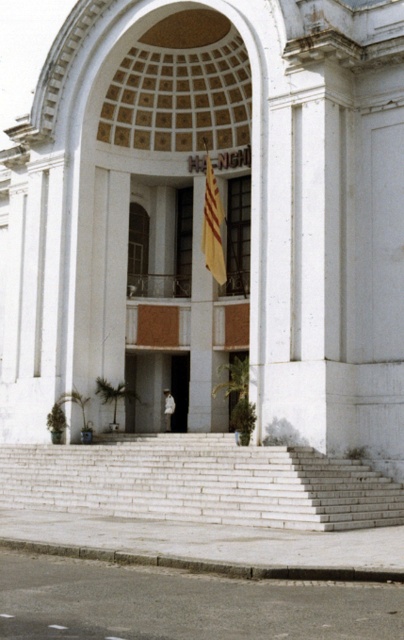
You are a visitor approaching the grand classical building. You see the white stone stairs at center and the white matte skateboarder at center. Which object is closer to the entrance?

The white matte skateboarder at center is closer to the entrance because it is positioned above the white stone stairs at center, which are located under it.

You are a delivery person with a cart that is 1.2 meters wide. You need to move from the white stone stairs at center to the white matte skateboarder at center. Is there enough space between them for your cart to pass through?

The white stone stairs at center and white matte skateboarder at center are 9.74 meters apart from each other. Since the cart is only 1.2 meters wide, there is more than enough space for the cart to pass through between them.

Looking at this image, you are a photographer trying to capture both the yellow fabric flag at center and the white matte skateboarder at center in a single shot. Based on their sizes, which one should you focus on to ensure both are clearly visible in the frame?

The yellow fabric flag at center is larger than the white matte skateboarder at center, so focusing on the flag will help ensure both are clearly visible in the frame since it occupies more space.